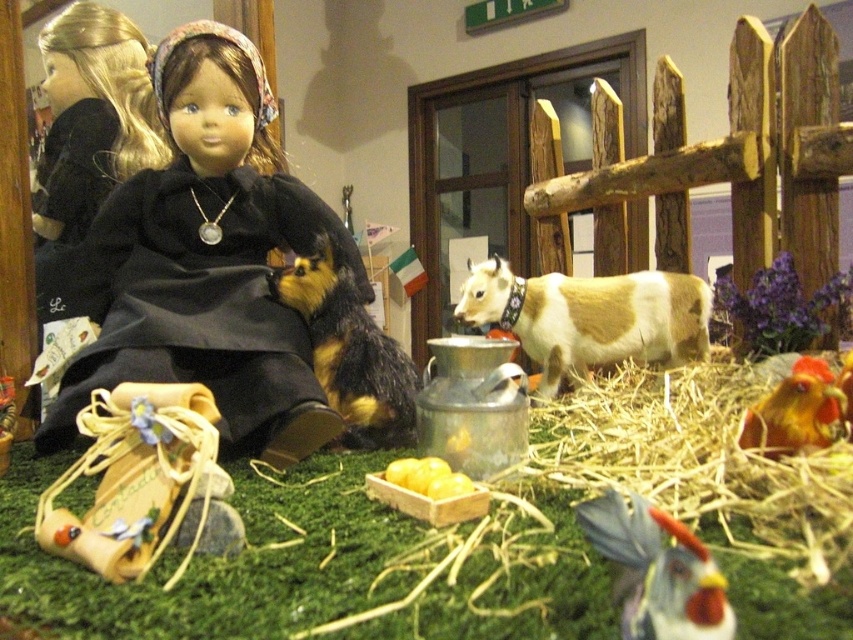
Between matte yellow fabric boot at lower left and smooth brown rooster at lower right, which one has less height?

smooth brown rooster at lower right is shorter.

Is matte yellow fabric boot at lower left closer to the viewer compared to smooth brown rooster at lower right?

That is True.

At what (x,y) coordinates should I click in order to perform the action: click on matte yellow fabric boot at lower left. Please return your answer as a coordinate pair (x, y). The height and width of the screenshot is (640, 853). Looking at the image, I should click on (137, 480).

This screenshot has width=853, height=640. Identify the location of matte yellow fabric boot at lower left. (137, 480).

Does point (144, 362) lie behind point (135, 497)?

Yes, point (144, 362) is farther from viewer.

Is matte black dress at center bigger than matte yellow fabric boot at lower left?

Correct, matte black dress at center is larger in size than matte yellow fabric boot at lower left.

Is point (262, 276) closer to camera compared to point (102, 422)?

No, it is not.

I want to click on matte black dress at center, so click(206, 260).

From the picture: Can you confirm if straw hay at lower right is positioned to the left of multicolored feathered rooster at lower right?

Incorrect, straw hay at lower right is not on the left side of multicolored feathered rooster at lower right.

Is point (688, 428) less distant than point (679, 586)?

No, (688, 428) is further to viewer.

Is point (839, 515) closer to viewer compared to point (660, 579)?

No, (839, 515) is behind (660, 579).

I want to click on straw hay at lower right, so click(700, 460).